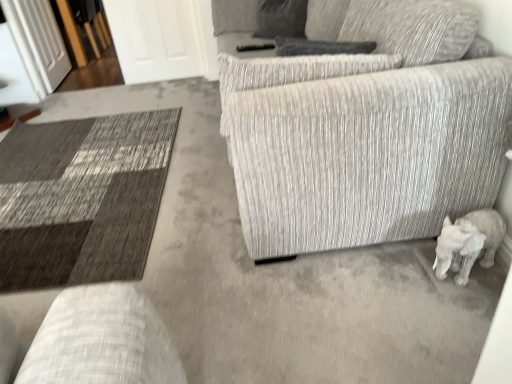
How much space does transparent glass door at upper left, arranged as the 2th glass door when viewed from the right, occupy horizontally?

transparent glass door at upper left, arranged as the 2th glass door when viewed from the right, is 4.75 inches in width.

Where is `gray fabric pillow at upper center`? The image size is (512, 384). gray fabric pillow at upper center is located at coordinates (281, 18).

Identify the location of textured gray couch at center. (362, 125).

Locate an element on the screen. This screenshot has width=512, height=384. studio couch above the white matte elephant at lower right (from a real-world perspective) is located at coordinates point(362,125).

How different are the orientations of textured gray couch at center and white matte elephant at lower right in degrees?

The angle between the facing direction of textured gray couch at center and the facing direction of white matte elephant at lower right is 1.85 degrees.

Considering the positions of objects textured gray couch at center and white matte elephant at lower right in the image provided, who is more to the right, textured gray couch at center or white matte elephant at lower right?

From the viewer's perspective, white matte elephant at lower right appears more on the right side.

From a real-world perspective, between textured gray couch at center and white matte elephant at lower right, who is vertically lower?

white matte elephant at lower right is physically lower.

Between white matte elephant at lower right and textured gray couch at center, which one has less height?

With less height is white matte elephant at lower right.

Is white matte elephant at lower right positioned with its back to textured gray couch at center?

No.

From a real-world perspective, is white matte elephant at lower right over textured gray couch at center?

No.

What are the coordinates of `studio couch on the right side of transparent glass door at upper left, placed as the first glass door when sorted from left to right` in the screenshot? It's located at (362, 125).

Measure the distance between textured gray couch at center and transparent glass door at upper left, placed as the first glass door when sorted from left to right.

The distance of textured gray couch at center from transparent glass door at upper left, placed as the first glass door when sorted from left to right, is 2.77 meters.

Looking at this image, from a real-world perspective, is textured gray couch at center under transparent glass door at upper left, arranged as the 2th glass door when viewed from the right?

No.

Can you confirm if textured gray couch at center is positioned to the left of transparent glass door at upper left, arranged as the 2th glass door when viewed from the right?

Incorrect, textured gray couch at center is not on the left side of transparent glass door at upper left, arranged as the 2th glass door when viewed from the right.

Between point (133, 56) and point (489, 218), which one is positioned behind?

The point (133, 56) is farther from the camera.

Considering the relative sizes of white glossy door at upper left, acting as the first glass door starting from the right, and white matte elephant at lower right in the image provided, is white glossy door at upper left, acting as the first glass door starting from the right, taller than white matte elephant at lower right?

Yes.

From the image's perspective, is white glossy door at upper left, which is counted as the second glass door, starting from the left, located beneath white matte elephant at lower right?

No, from the image's perspective, white glossy door at upper left, which is counted as the second glass door, starting from the left, is not beneath white matte elephant at lower right.

Is white glossy door at upper left, acting as the first glass door starting from the right, facing towards white matte elephant at lower right?

Yes, white glossy door at upper left, acting as the first glass door starting from the right, is turned towards white matte elephant at lower right.

Considering the relative sizes of gray fabric pillow at upper center and white matte elephant at lower right in the image provided, is gray fabric pillow at upper center smaller than white matte elephant at lower right?

Actually, gray fabric pillow at upper center might be larger than white matte elephant at lower right.

Does gray fabric pillow at upper center have a lesser width compared to white matte elephant at lower right?

Yes, gray fabric pillow at upper center is thinner than white matte elephant at lower right.

Which is further, (256,32) or (454,249)?

Positioned behind is point (256,32).

Looking at this image, from the image's perspective, does gray fabric pillow at upper center appear lower than white matte elephant at lower right?

No.

From a real-world perspective, is gray fabric pillow at upper center physically above transparent glass door at upper left, placed as the first glass door when sorted from left to right?

Yes, from a real-world perspective, gray fabric pillow at upper center is on top of transparent glass door at upper left, placed as the first glass door when sorted from left to right.

In the scene shown: Who is smaller, gray fabric pillow at upper center or transparent glass door at upper left, arranged as the 2th glass door when viewed from the right?

Smaller between the two is gray fabric pillow at upper center.

Is gray fabric pillow at upper center far from transparent glass door at upper left, placed as the first glass door when sorted from left to right?

That's right, there is a large distance between gray fabric pillow at upper center and transparent glass door at upper left, placed as the first glass door when sorted from left to right.

Measure the distance from gray fabric pillow at upper center to transparent glass door at upper left, placed as the first glass door when sorted from left to right.

gray fabric pillow at upper center is 6.54 feet away from transparent glass door at upper left, placed as the first glass door when sorted from left to right.

From the picture: Between white matte elephant at lower right and white glossy door at upper left, which is counted as the second glass door, starting from the left, which one appears on the left side from the viewer's perspective?

From the viewer's perspective, white glossy door at upper left, which is counted as the second glass door, starting from the left, appears more on the left side.

Does white matte elephant at lower right turn towards white glossy door at upper left, which is counted as the second glass door, starting from the left?

No, white matte elephant at lower right is not aimed at white glossy door at upper left, which is counted as the second glass door, starting from the left.

From a real-world perspective, relative to white glossy door at upper left, which is counted as the second glass door, starting from the left, is white matte elephant at lower right vertically above or below?

Clearly, from a real-world perspective, white matte elephant at lower right is below white glossy door at upper left, which is counted as the second glass door, starting from the left.

Identify the location of animal on the right of the textured gray couch at center. (468, 243).

At what (x,y) coordinates should I click in order to perform the action: click on studio couch above the white matte elephant at lower right (from a real-world perspective). Please return your answer as a coordinate pair (x, y). Image resolution: width=512 pixels, height=384 pixels. Looking at the image, I should click on (362, 125).

When comparing their distances from gray fabric pillow at upper center, does white glossy door at upper left, acting as the first glass door starting from the right, or white matte elephant at lower right seem further?

Based on the image, white matte elephant at lower right appears to be further to gray fabric pillow at upper center.

Looking at the image, which one is located further to gray fabric pillow at upper center, textured gray couch at center or white glossy door at upper left, acting as the first glass door starting from the right?

The object further to gray fabric pillow at upper center is textured gray couch at center.

From the image, which object appears to be farther from gray fabric pillow at upper center, white glossy door at upper left, which is counted as the second glass door, starting from the left, or textured gray couch at center?

Based on the image, textured gray couch at center appears to be further to gray fabric pillow at upper center.

Considering their positions, is gray fabric pillow at upper center positioned closer to white glossy door at upper left, which is counted as the second glass door, starting from the left, than transparent glass door at upper left, placed as the first glass door when sorted from left to right?

Based on the image, transparent glass door at upper left, placed as the first glass door when sorted from left to right, appears to be nearer to white glossy door at upper left, which is counted as the second glass door, starting from the left.

Estimate the real-world distances between objects in this image. Which object is further from gray fabric pillow at upper center, textured gray couch at center or transparent glass door at upper left, placed as the first glass door when sorted from left to right?

transparent glass door at upper left, placed as the first glass door when sorted from left to right, is positioned further to the anchor gray fabric pillow at upper center.

Considering their positions, is textured gray couch at center positioned further to white matte elephant at lower right than transparent glass door at upper left, placed as the first glass door when sorted from left to right?

Based on the image, transparent glass door at upper left, placed as the first glass door when sorted from left to right, appears to be further to white matte elephant at lower right.

Based on their spatial positions, is white matte elephant at lower right or textured gray couch at center further from gray fabric pillow at upper center?

The object further to gray fabric pillow at upper center is white matte elephant at lower right.

Considering their positions, is textured gray couch at center positioned further to transparent glass door at upper left, arranged as the 2th glass door when viewed from the right, than white matte elephant at lower right?

Among the two, white matte elephant at lower right is located further to transparent glass door at upper left, arranged as the 2th glass door when viewed from the right.

The height and width of the screenshot is (384, 512). Identify the location of glass door situated between transparent glass door at upper left, arranged as the 2th glass door when viewed from the right, and white matte elephant at lower right from left to right. (162, 39).

The height and width of the screenshot is (384, 512). In order to click on studio couch between transparent glass door at upper left, placed as the first glass door when sorted from left to right, and white matte elephant at lower right from left to right in this screenshot , I will do `click(362, 125)`.

The image size is (512, 384). In order to click on animal positioned between textured gray couch at center and gray fabric pillow at upper center from near to far in this screenshot , I will do `click(468, 243)`.

I want to click on animal between textured gray couch at center and white glossy door at upper left, acting as the first glass door starting from the right, in the front-back direction, so click(468, 243).